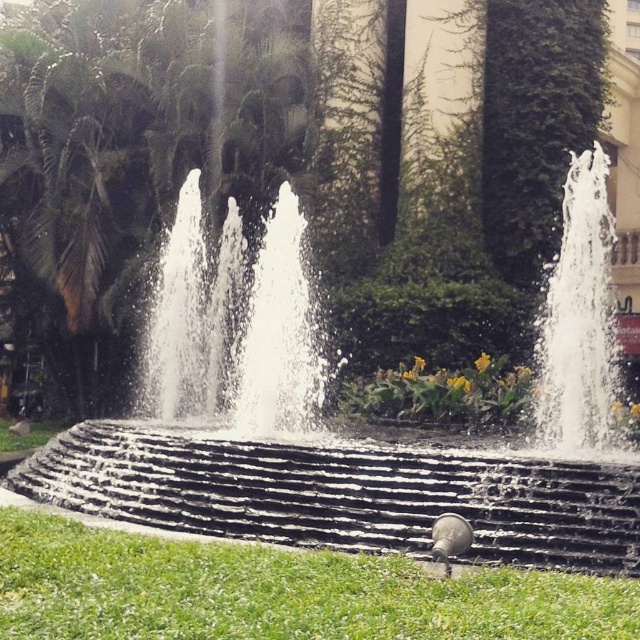
You are standing in front of the fountain and want to determine the relative positions of two points in the scene. The first point is at coordinate point (278, 221) and the second is at point (595, 381). Which point is closer to you?

Point (278, 221) is closer to you because it is further to the viewer than point (595, 381).

You are a landscape architect designing a new garden. You want to place a decorative statue that is 2 meters wide between the black stone fountain at center and the clear glass water at upper right. Based on their sizes, will the statue fit comfortably between them without overcrowding the space?

The black stone fountain at center is larger in size than clear glass water at upper right. Since the statue is 2 meters wide, it might not fit comfortably between them if the space between the two objects is smaller than 2 meters. However, since the fountain is larger, there might be enough space. But without knowing the exact distance between them, it is hard to determine. However, the question only provides size comparison, not distance. Therefore, based on the given information, we cannot accurately say

You are standing at the point with coordinates point (x=394, y=454). Based on the scene description, what object are you currently standing on?

The point (x=394, y=454) corresponds to the black stone fountain at center, so you are standing on the black stone fountain at center.